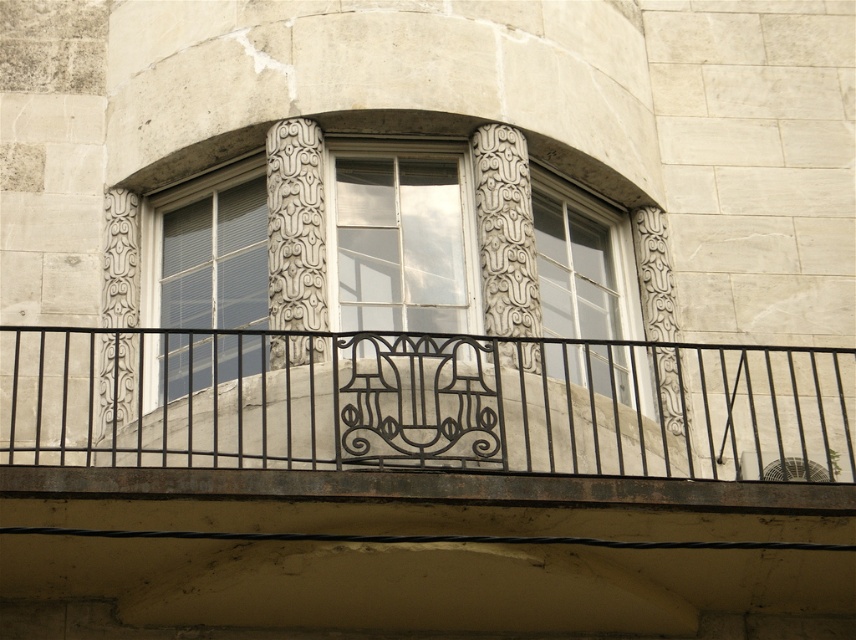
Question: Does black wrought iron balcony at center come behind clear glass window at center?

Choices:
 (A) yes
 (B) no

Answer: (B)

Question: Considering the real-world distances, which object is farthest from the white glass window at center?

Choices:
 (A) clear glass window at center
 (B) black wrought iron balcony at center

Answer: (B)

Question: Among these objects, which one is nearest to the camera?

Choices:
 (A) white glass window at center
 (B) clear glass window at center
 (C) black wrought iron balcony at center
 (D) clear glass window at upper right

Answer: (C)

Question: Is black wrought iron balcony at center bigger than white glass window at center?

Choices:
 (A) no
 (B) yes

Answer: (B)

Question: Does white glass window at center appear over clear glass window at upper right?

Choices:
 (A) yes
 (B) no

Answer: (B)

Question: Which object appears closest to the camera in this image?

Choices:
 (A) clear glass window at upper right
 (B) clear glass window at center
 (C) black wrought iron balcony at center
 (D) white glass window at center

Answer: (C)